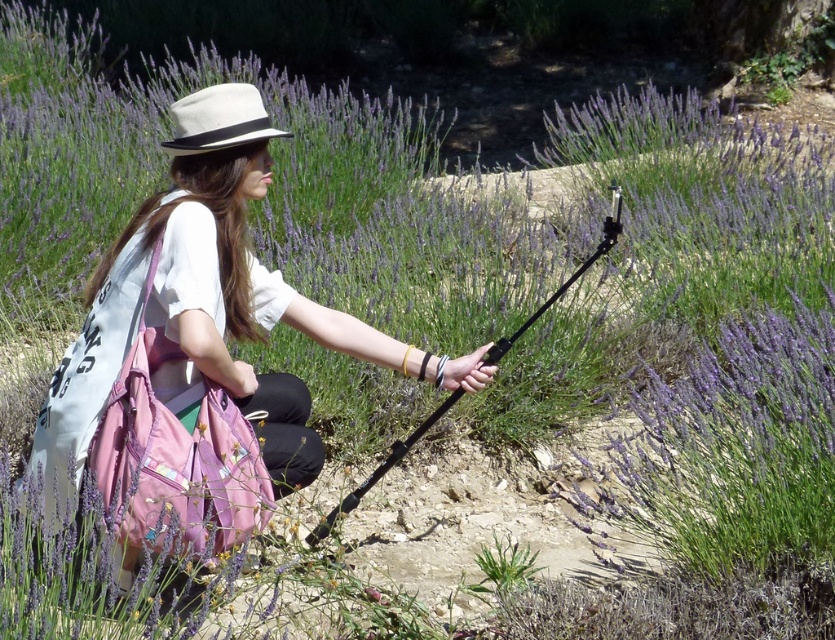
Question: Is pink fabric bag at center to the right of white felt fedora at upper center from the viewer's perspective?

Choices:
 (A) no
 (B) yes

Answer: (A)

Question: Based on their relative distances, which object is nearer to the black matte tripod at center?

Choices:
 (A) white felt fedora at upper center
 (B) pink fabric bag at center

Answer: (B)

Question: Does pink fabric bag at center appear over black matte tripod at center?

Choices:
 (A) no
 (B) yes

Answer: (B)

Question: Which object is the farthest from the black matte tripod at center?

Choices:
 (A) white felt fedora at upper center
 (B) pink fabric bag at center

Answer: (A)

Question: Which of the following is the closest to the observer?

Choices:
 (A) 201,131
 (B) 311,534

Answer: (A)

Question: Is white felt fedora at upper center smaller than black matte tripod at center?

Choices:
 (A) no
 (B) yes

Answer: (B)